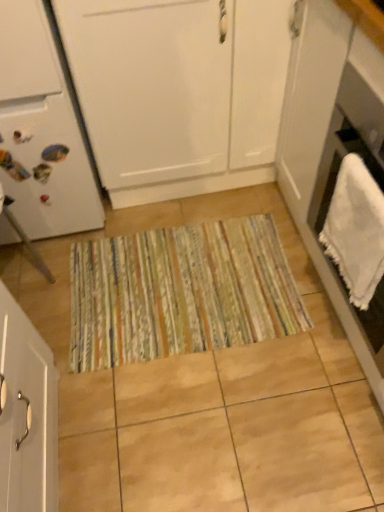
Question: Are white matte cabinet at center, the first cabinetry from the top, and white matte cabinet at lower left, the first cabinetry from the bottom, far apart?

Choices:
 (A) yes
 (B) no

Answer: (B)

Question: Is white matte cabinet at center, the first cabinetry from the top, further to camera compared to white matte cabinet at lower left, the second cabinetry when ordered from top to bottom?

Choices:
 (A) yes
 (B) no

Answer: (A)

Question: Is the position of white matte cabinet at center, the second cabinetry positioned from the bottom, less distant than that of white matte cabinet at lower left, the first cabinetry from the bottom?

Choices:
 (A) no
 (B) yes

Answer: (A)

Question: Is white matte cabinet at center, the first cabinetry from the top, outside of white matte cabinet at lower left, the first cabinetry from the bottom?

Choices:
 (A) yes
 (B) no

Answer: (A)

Question: Is white matte cabinet at center, the first cabinetry from the top, shorter than white matte cabinet at lower left, the second cabinetry when ordered from top to bottom?

Choices:
 (A) no
 (B) yes

Answer: (A)

Question: Is white matte cabinet at center, the first cabinetry from the top, bigger than white matte cabinet at lower left, the first cabinetry from the bottom?

Choices:
 (A) no
 (B) yes

Answer: (B)

Question: Does white matte cabinet at center, the first cabinetry from the top, appear on the right side of white matte refrigerator at left?

Choices:
 (A) yes
 (B) no

Answer: (A)

Question: Could you tell me if white matte cabinet at center, the second cabinetry positioned from the bottom, is facing white matte refrigerator at left?

Choices:
 (A) yes
 (B) no

Answer: (B)

Question: Is white matte cabinet at center, the second cabinetry positioned from the bottom, smaller than white matte refrigerator at left?

Choices:
 (A) yes
 (B) no

Answer: (B)

Question: Does white matte cabinet at center, the second cabinetry positioned from the bottom, have a larger size compared to white matte refrigerator at left?

Choices:
 (A) yes
 (B) no

Answer: (A)

Question: Is white matte refrigerator at left at the back of white matte cabinet at center, the second cabinetry positioned from the bottom?

Choices:
 (A) yes
 (B) no

Answer: (B)

Question: Can you confirm if white matte cabinet at center, the second cabinetry positioned from the bottom, is thinner than white matte refrigerator at left?

Choices:
 (A) yes
 (B) no

Answer: (A)

Question: Is white matte refrigerator at left to the left of white matte cabinet at center, the second cabinetry positioned from the bottom, from the viewer's perspective?

Choices:
 (A) yes
 (B) no

Answer: (A)